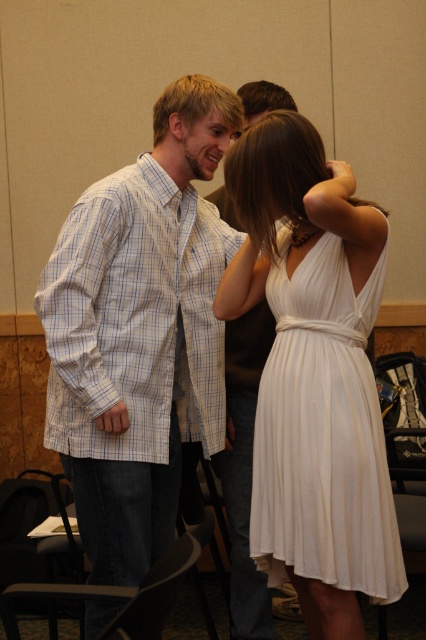
Question: Which object is the farthest from the white pleated dress at center?

Choices:
 (A) checkered fabric shirt at center
 (B) light blue plaid shirt at center

Answer: (B)

Question: Considering the real-world distances, which object is farthest from the checkered fabric shirt at center?

Choices:
 (A) white pleated dress at center
 (B) light blue plaid shirt at center

Answer: (A)

Question: Which of these objects is positioned closest to the white pleated dress at center?

Choices:
 (A) light blue plaid shirt at center
 (B) checkered fabric shirt at center

Answer: (B)

Question: Is checkered fabric shirt at center to the left of light blue plaid shirt at center from the viewer's perspective?

Choices:
 (A) yes
 (B) no

Answer: (A)

Question: Where is checkered fabric shirt at center located in relation to light blue plaid shirt at center in the image?

Choices:
 (A) left
 (B) right

Answer: (A)

Question: Does checkered fabric shirt at center have a smaller size compared to white pleated dress at center?

Choices:
 (A) yes
 (B) no

Answer: (B)